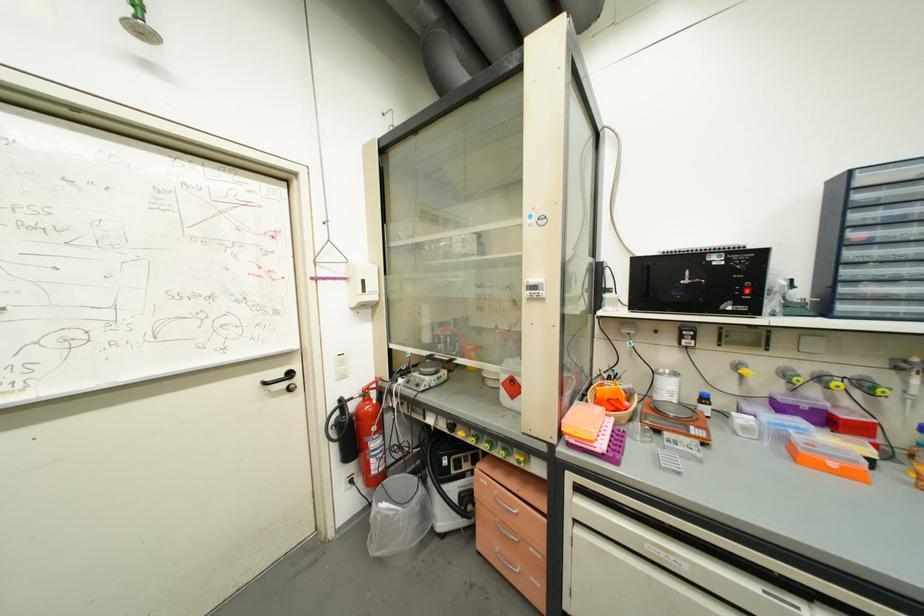
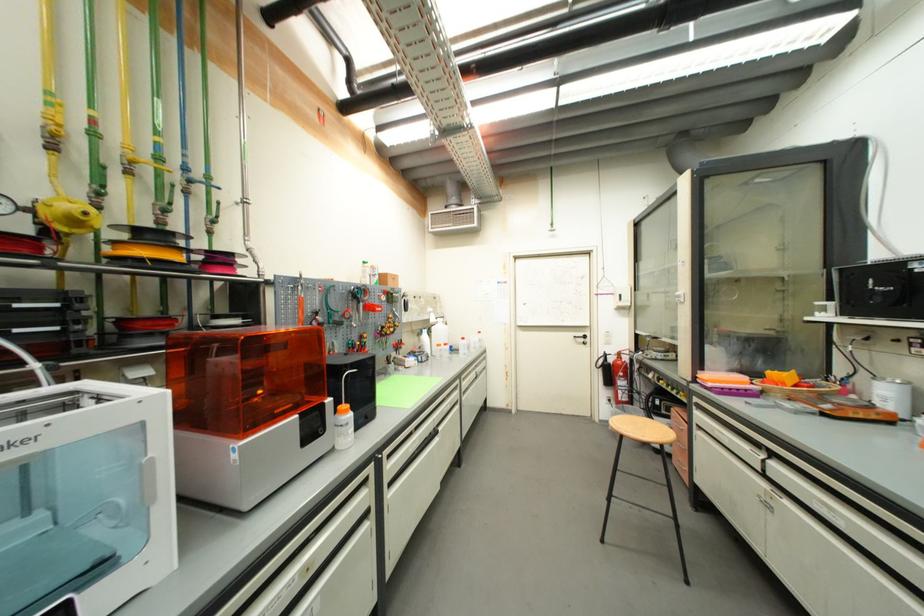
Where in the second image is the point corresponding to the point at 386,454 from the first image?

(630, 391)